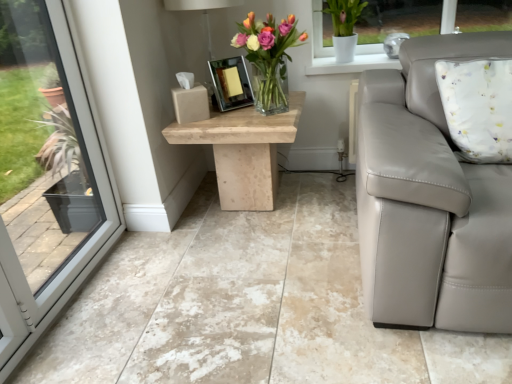
The image size is (512, 384). I want to click on free point below natural stone table at center (from a real-world perspective), so click(247, 210).